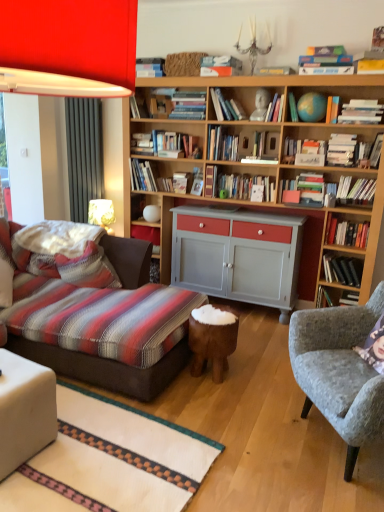
Question: From the image's perspective, is hardcover books at upper right, the twelfth book from the left, over hardcover book at center, which is the 2th book in left-to-right order?

Choices:
 (A) yes
 (B) no

Answer: (A)

Question: Is hardcover books at upper right, the twelfth book from the left, far away from hardcover book at center, which is the 2th book in left-to-right order?

Choices:
 (A) yes
 (B) no

Answer: (A)

Question: Does hardcover books at upper right, the twelfth book from the left, lie in front of hardcover book at center, which is the 2th book in left-to-right order?

Choices:
 (A) yes
 (B) no

Answer: (A)

Question: Is hardcover books at upper right, the twelfth book from the left, aimed at hardcover book at center, which is the 2th book in left-to-right order?

Choices:
 (A) yes
 (B) no

Answer: (B)

Question: From the image's perspective, is hardcover books at upper right, which is the 9th book from right to left, beneath hardcover book at center, which is the 19th book in right-to-left order?

Choices:
 (A) no
 (B) yes

Answer: (A)

Question: Relative to hardcover books at upper right, which is the 9th book from right to left, is hardcover book at upper right, the eighth book in the right-to-left sequence, in front or behind?

Choices:
 (A) behind
 (B) front

Answer: (A)

Question: In terms of width, does hardcover book at upper right, the 13th book viewed from the left, look wider or thinner when compared to hardcover books at upper right, the twelfth book from the left?

Choices:
 (A) thin
 (B) wide

Answer: (A)

Question: Considering the positions of hardcover book at upper right, the eighth book in the right-to-left sequence, and hardcover books at upper right, the twelfth book from the left, in the image, is hardcover book at upper right, the eighth book in the right-to-left sequence, bigger or smaller than hardcover books at upper right, the twelfth book from the left,?

Choices:
 (A) big
 (B) small

Answer: (B)

Question: Does point (327, 121) appear closer or farther from the camera than point (316, 73)?

Choices:
 (A) farther
 (B) closer

Answer: (A)

Question: Is point (148, 135) positioned closer to the camera than point (16, 464)?

Choices:
 (A) farther
 (B) closer

Answer: (A)

Question: In the image, is hardcover book at center, which is the 19th book in right-to-left order, positioned in front of or behind white fabric ottoman at lower left?

Choices:
 (A) behind
 (B) front

Answer: (A)

Question: Looking at the image, does hardcover book at center, which is the 2th book in left-to-right order, seem bigger or smaller compared to white fabric ottoman at lower left?

Choices:
 (A) small
 (B) big

Answer: (A)

Question: Would you say hardcover book at center, which is the 19th book in right-to-left order, is inside or outside white fabric ottoman at lower left?

Choices:
 (A) inside
 (B) outside

Answer: (B)

Question: Is hardcover book at upper right, the 13th book viewed from the left, bigger or smaller than white fabric ottoman at lower left?

Choices:
 (A) big
 (B) small

Answer: (B)

Question: From a real-world perspective, is hardcover book at upper right, the 13th book viewed from the left, positioned above or below white fabric ottoman at lower left?

Choices:
 (A) below
 (B) above

Answer: (B)